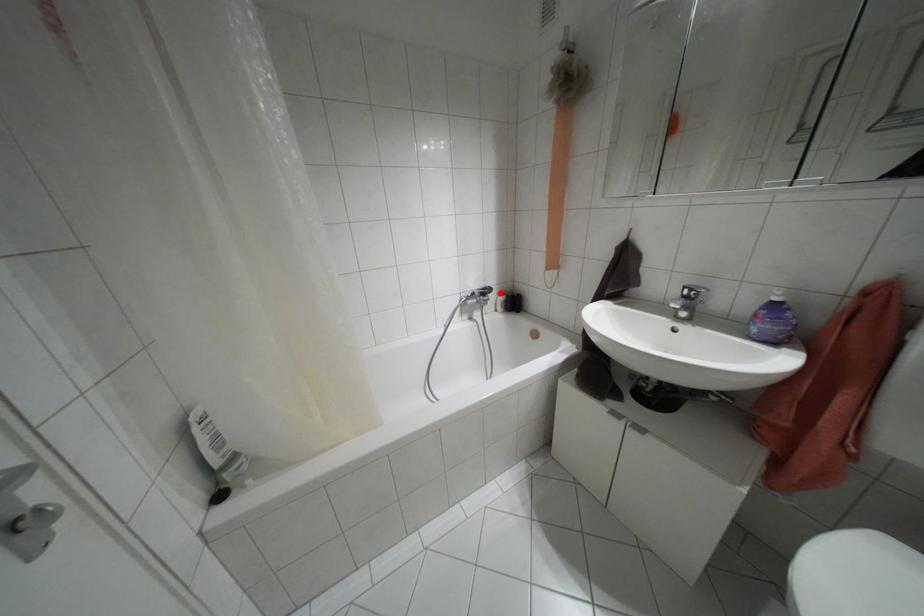
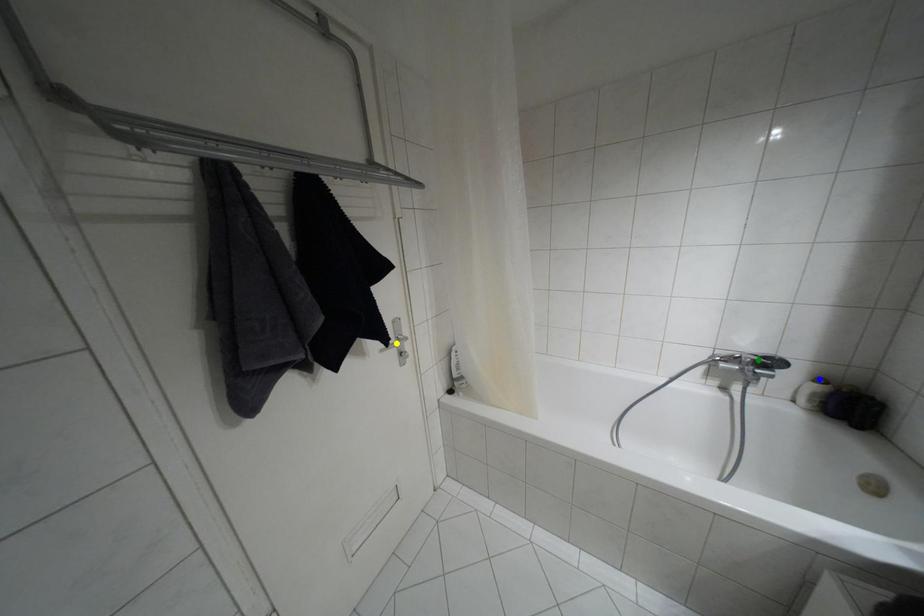
Question: I am providing you with two images of the same scene from different viewpoints. A red point is marked on the first image. You are given multiple points on the second image. In image 2, which mark is for the same physical point as the one in image 1?

Choices:
 (A) green point
 (B) yellow point
 (C) blue point

Answer: (C)